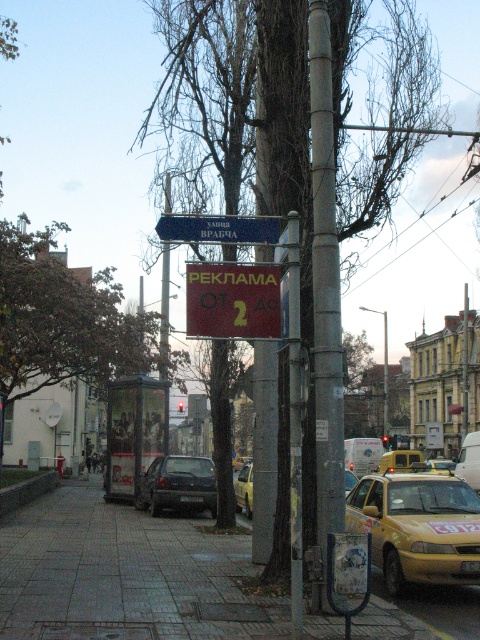
From the picture: Does red plastic sign at center appear on the right side of yellow matte taxi at center?

No, red plastic sign at center is not to the right of yellow matte taxi at center.

Does point (231, 308) come farther from viewer compared to point (416, 456)?

That is False.

Which is in front, point (250, 275) or point (410, 452)?

Point (250, 275)

You are a GUI agent. You are given a task and a screenshot of the screen. Output one action in this format:
    pyautogui.click(x=<x>, y=<y>)
    Task: Click on the red plastic sign at center
    
    Given the screenshot: What is the action you would take?
    pyautogui.click(x=232, y=300)

Does brown bark tree at center appear over yellow matte taxi at lower right?

Yes, brown bark tree at center is above yellow matte taxi at lower right.

Is brown bark tree at center to the left of yellow matte taxi at lower right from the viewer's perspective?

No, brown bark tree at center is not to the left of yellow matte taxi at lower right.

Does point (272, 19) come farther from viewer compared to point (464, 486)?

No, (272, 19) is in front of (464, 486).

Where is `brown bark tree at center`? brown bark tree at center is located at coordinates (382, 108).

Who is shorter, blue plastic sign at upper center or metallic silver parking sign at lower center?

With less height is blue plastic sign at upper center.

Is blue plastic sign at upper center shorter than metallic silver parking sign at lower center?

Yes, blue plastic sign at upper center is shorter than metallic silver parking sign at lower center.

Does point (157, 227) come farther from viewer compared to point (365, 600)?

Yes.

Locate an element on the screen. This screenshot has height=640, width=480. blue plastic sign at upper center is located at coordinates (218, 228).